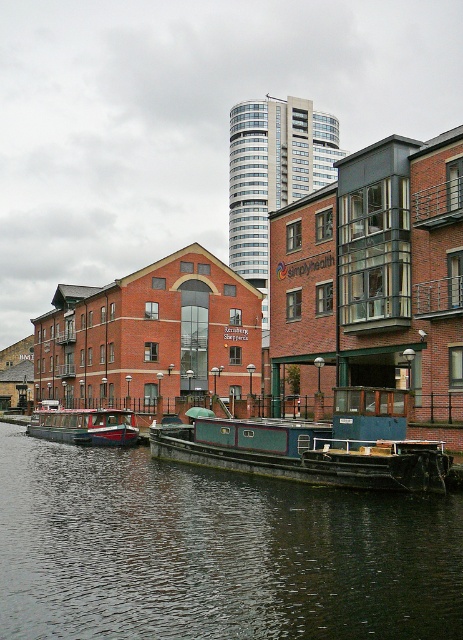
Does teal matte barge at center have a lesser width compared to red polished wood boat at center?

Correct, teal matte barge at center's width is less than red polished wood boat at center's.

Does teal matte barge at center lie in front of red polished wood boat at center?

Yes, teal matte barge at center is in front of red polished wood boat at center.

Is point (150, 444) farther from viewer compared to point (105, 435)?

No, (150, 444) is in front of (105, 435).

At what (x,y) coordinates should I click in order to perform the action: click on teal matte barge at center. Please return your answer as a coordinate pair (x, y). The image size is (463, 640). Looking at the image, I should click on (306, 451).

Does dark green water at center appear on the left side of red polished wood boat at center?

Incorrect, dark green water at center is not on the left side of red polished wood boat at center.

Between point (12, 536) and point (130, 440), which one is positioned in front?

Point (12, 536) is more forward.

At what (x,y) coordinates should I click in order to perform the action: click on dark green water at center. Please return your answer as a coordinate pair (x, y). The width and height of the screenshot is (463, 640). Looking at the image, I should click on (214, 552).

Who is positioned more to the left, dark green water at center or teal matte barge at center?

Positioned to the left is dark green water at center.

Who is more forward, (401,545) or (200,406)?

Positioned in front is point (401,545).

Identify the location of dark green water at center. The image size is (463, 640). (214, 552).